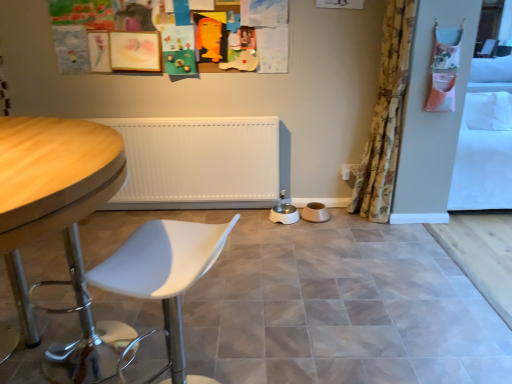
Question: Considering the relative positions of floral fabric curtain at right and white plastic swivel chair at lower left in the image provided, is floral fabric curtain at right behind white plastic swivel chair at lower left?

Choices:
 (A) no
 (B) yes

Answer: (B)

Question: Is floral fabric curtain at right wider than white plastic swivel chair at lower left?

Choices:
 (A) yes
 (B) no

Answer: (B)

Question: Does floral fabric curtain at right have a lesser height compared to white plastic swivel chair at lower left?

Choices:
 (A) yes
 (B) no

Answer: (B)

Question: Considering the relative sizes of floral fabric curtain at right and white plastic swivel chair at lower left in the image provided, is floral fabric curtain at right taller than white plastic swivel chair at lower left?

Choices:
 (A) no
 (B) yes

Answer: (B)

Question: Is floral fabric curtain at right placed right next to white plastic swivel chair at lower left?

Choices:
 (A) no
 (B) yes

Answer: (A)

Question: Looking at the image, does white plastic swivel chair at lower left seem bigger or smaller compared to matte ceramic tile at center?

Choices:
 (A) small
 (B) big

Answer: (A)

Question: Considering the positions of white plastic swivel chair at lower left and matte ceramic tile at center in the image, is white plastic swivel chair at lower left wider or thinner than matte ceramic tile at center?

Choices:
 (A) wide
 (B) thin

Answer: (B)

Question: Which is correct: white plastic swivel chair at lower left is inside matte ceramic tile at center, or outside of it?

Choices:
 (A) inside
 (B) outside

Answer: (B)

Question: Considering the positions of point (138, 244) and point (419, 372), is point (138, 244) closer or farther from the camera than point (419, 372)?

Choices:
 (A) closer
 (B) farther

Answer: (A)

Question: Considering the positions of floral fabric curtain at right and matte ceramic tile at center in the image, is floral fabric curtain at right wider or thinner than matte ceramic tile at center?

Choices:
 (A) thin
 (B) wide

Answer: (A)

Question: Is point (396, 51) closer or farther from the camera than point (263, 228)?

Choices:
 (A) closer
 (B) farther

Answer: (A)

Question: From the image's perspective, is floral fabric curtain at right located above or below matte ceramic tile at center?

Choices:
 (A) below
 (B) above

Answer: (B)

Question: In the image, is floral fabric curtain at right on the left side or the right side of matte ceramic tile at center?

Choices:
 (A) right
 (B) left

Answer: (A)

Question: Is floral fabric curtain at right situated inside wooden table at left or outside?

Choices:
 (A) outside
 (B) inside

Answer: (A)

Question: Considering the relative positions of floral fabric curtain at right and wooden table at left in the image provided, is floral fabric curtain at right to the left or to the right of wooden table at left?

Choices:
 (A) left
 (B) right

Answer: (B)